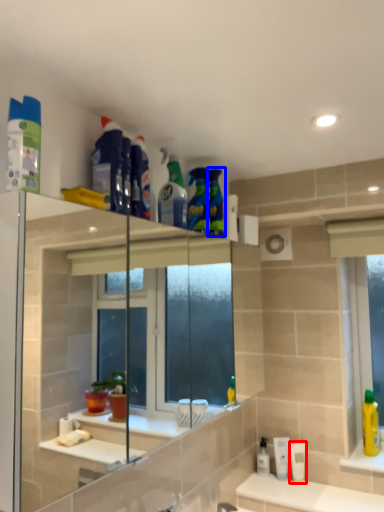
Question: Which object appears closest to the camera in this image, mouthwash (highlighted by a red box) or cleaning product (highlighted by a blue box)?

Choices:
 (A) mouthwash
 (B) cleaning product

Answer: (B)